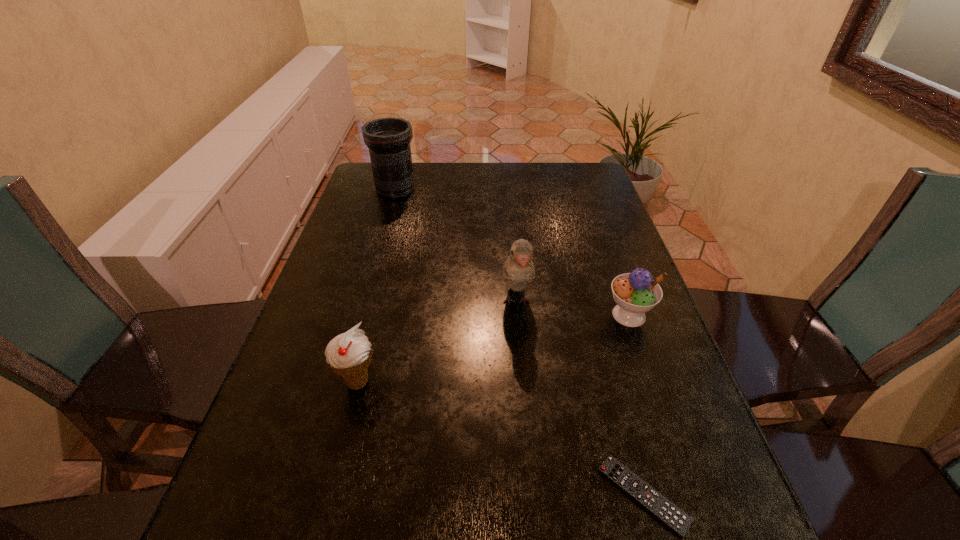
At what (x,y) coordinates should I click in order to perform the action: click on the farthest object. Please return your answer as a coordinate pair (x, y). The width and height of the screenshot is (960, 540). Looking at the image, I should click on tap(388, 139).

The height and width of the screenshot is (540, 960). What are the coordinates of `bird` in the screenshot? It's located at (518, 270).

I want to click on the left icecream, so click(x=349, y=354).

The width and height of the screenshot is (960, 540). In order to click on the second nearest object in this screenshot , I will do `click(349, 354)`.

I want to click on the right icecream, so click(x=635, y=293).

Identify the location of the second shortest object. (635, 293).

Where is `remote control`? This screenshot has height=540, width=960. remote control is located at coordinates (669, 514).

Identify the location of the nearest object. (669, 514).

The height and width of the screenshot is (540, 960). I want to click on free space located 0.070m on the right of the telephoto lens, so click(x=439, y=189).

Where is `free location located at the face of the bird`? free location located at the face of the bird is located at coordinates (525, 406).